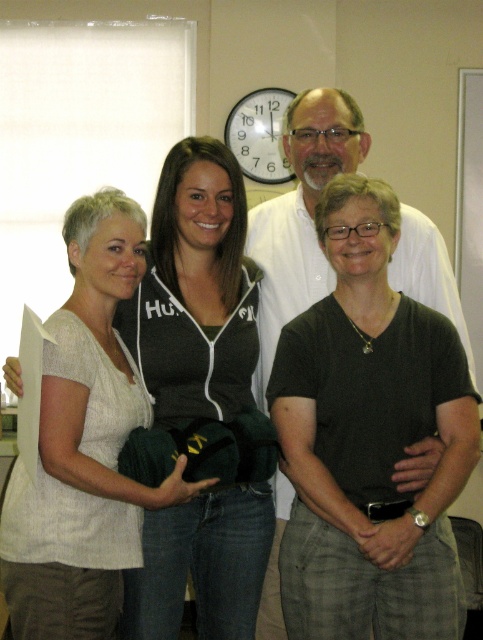
Question: Among these objects, which one is farthest from the camera?

Choices:
 (A) white matte shirt at upper center
 (B) white plastic clock at upper center
 (C) light beige fabric shirt at left

Answer: (B)

Question: Among these objects, which one is nearest to the camera?

Choices:
 (A) white matte shirt at upper center
 (B) light beige fabric shirt at left
 (C) white plastic clock at upper center

Answer: (B)

Question: Can you confirm if white matte shirt at upper center is smaller than white plastic clock at upper center?

Choices:
 (A) yes
 (B) no

Answer: (B)

Question: Can you confirm if white matte shirt at upper center is positioned to the right of white plastic clock at upper center?

Choices:
 (A) no
 (B) yes

Answer: (B)

Question: Estimate the real-world distances between objects in this image. Which object is farther from the white matte shirt at upper center?

Choices:
 (A) light beige fabric shirt at left
 (B) white plastic clock at upper center

Answer: (B)

Question: Can you confirm if white matte shirt at upper center is smaller than white plastic clock at upper center?

Choices:
 (A) yes
 (B) no

Answer: (B)